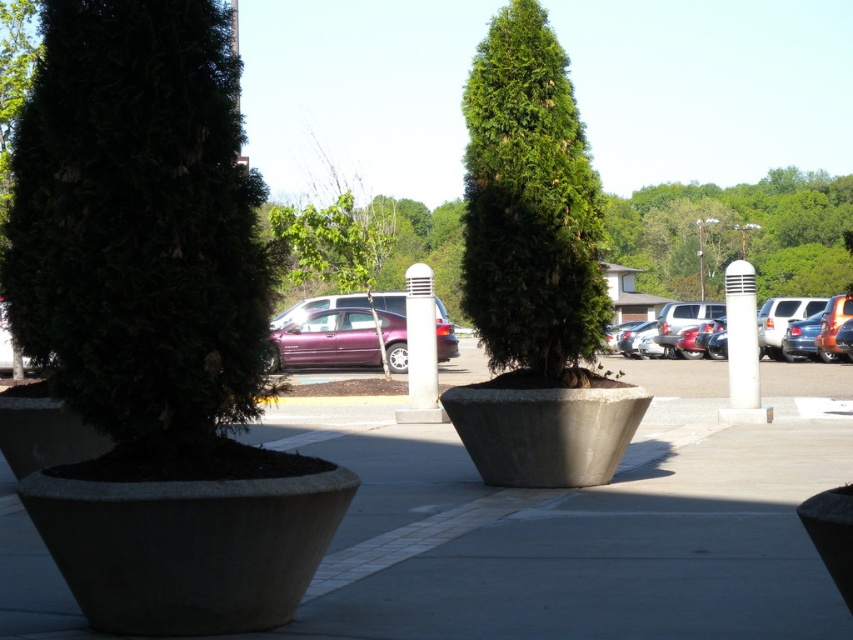
Question: Can you confirm if concrete at center is positioned above metallic purple sedan at center?

Choices:
 (A) yes
 (B) no

Answer: (B)

Question: Considering the real-world distances, which object is closest to the concrete at center?

Choices:
 (A) green matte tree at left
 (B) metallic silver sedan at center right
 (C) metallic purple sedan at center
 (D) green leafy tree at upper center

Answer: (A)

Question: Can you confirm if concrete at center is positioned above metallic silver sedan at center right?

Choices:
 (A) yes
 (B) no

Answer: (B)

Question: Can you confirm if concrete at center is positioned to the left of green leafy tree at center?

Choices:
 (A) no
 (B) yes

Answer: (B)

Question: Which point is closer to the camera?

Choices:
 (A) green leafy tree at upper center
 (B) green leafy tree at center
 (C) metallic purple sedan at center
 (D) concrete at center

Answer: (D)

Question: Which point is closer to the camera?

Choices:
 (A) (560, 304)
 (B) (358, 342)
 (C) (762, 220)

Answer: (A)